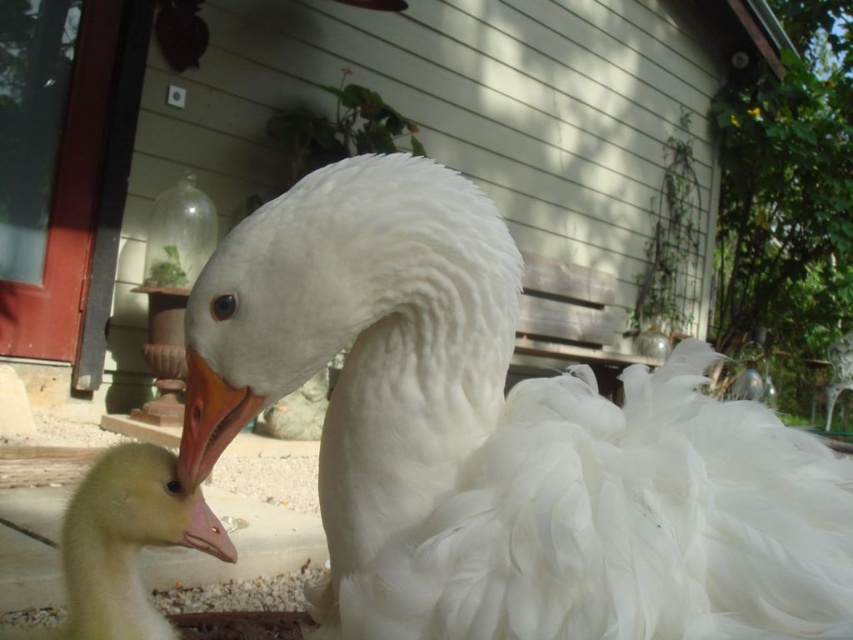
Question: Among these points, which one is nearest to the camera?

Choices:
 (A) (196, 499)
 (B) (412, 632)
 (C) (254, 404)

Answer: (B)

Question: Which of the following is the closest to the observer?

Choices:
 (A) pink matte beak at center
 (B) orange matte beak at center
 (C) yellow downy goose at lower left
 (D) white fluffy goose at center

Answer: (D)

Question: Can you confirm if yellow downy goose at lower left is positioned to the left of pink matte beak at center?

Choices:
 (A) no
 (B) yes

Answer: (B)

Question: Which object is the closest to the yellow downy goose at lower left?

Choices:
 (A) white fluffy goose at center
 (B) orange matte beak at center
 (C) pink matte beak at center

Answer: (C)

Question: Does white fluffy goose at center appear under orange matte beak at center?

Choices:
 (A) no
 (B) yes

Answer: (B)

Question: Can you confirm if white fluffy goose at center is bigger than pink matte beak at center?

Choices:
 (A) no
 (B) yes

Answer: (B)